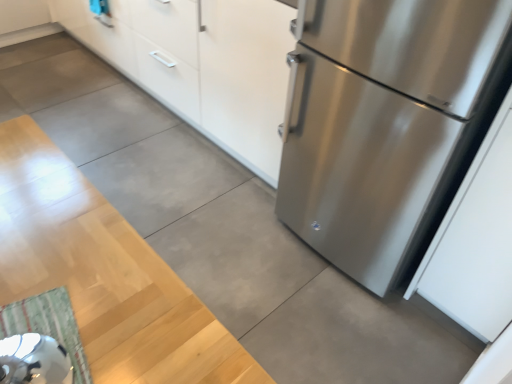
Question: In terms of width, does white matte cabinet at upper center look wider or thinner when compared to green striped rug at lower left?

Choices:
 (A) wide
 (B) thin

Answer: (A)

Question: Based on their positions, is white matte cabinet at upper center located to the left or right of green striped rug at lower left?

Choices:
 (A) left
 (B) right

Answer: (A)

Question: Which is nearer to the white matte cabinet at upper center?

Choices:
 (A) green striped rug at lower left
 (B) stainless steel refrigerator at right

Answer: (B)

Question: Which of these objects is positioned closest to the white matte cabinet at upper center?

Choices:
 (A) green striped rug at lower left
 (B) stainless steel refrigerator at right

Answer: (B)